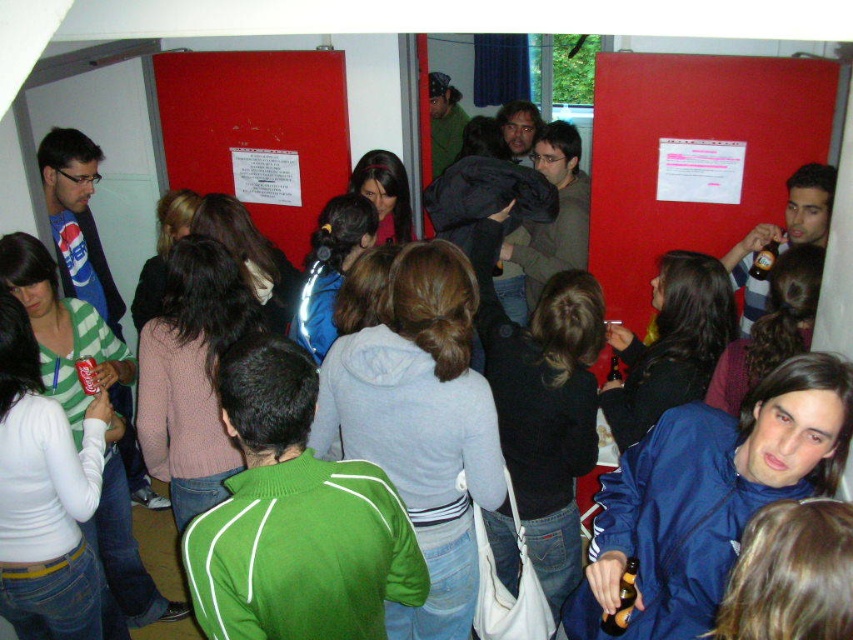
Question: Can you confirm if green sweater at center is smaller than blue fabric jacket at lower right?

Choices:
 (A) no
 (B) yes

Answer: (B)

Question: Which is nearer to the white paper at center?

Choices:
 (A) white paper at upper right
 (B) blue fabric jacket at lower right

Answer: (A)

Question: Is blue fabric jacket at lower right behind white paper at center?

Choices:
 (A) no
 (B) yes

Answer: (A)

Question: Considering the relative positions of green sweater at center and white paper at upper right in the image provided, where is green sweater at center located with respect to white paper at upper right?

Choices:
 (A) left
 (B) right

Answer: (A)

Question: Among these objects, which one is farthest from the camera?

Choices:
 (A) white paper at upper right
 (B) green sweater at center
 (C) blue fabric jacket at lower right
 (D) white paper at center

Answer: (D)

Question: Considering the real-world distances, which object is closest to the green sweater at center?

Choices:
 (A) white paper at upper right
 (B) blue fabric jacket at lower right

Answer: (B)